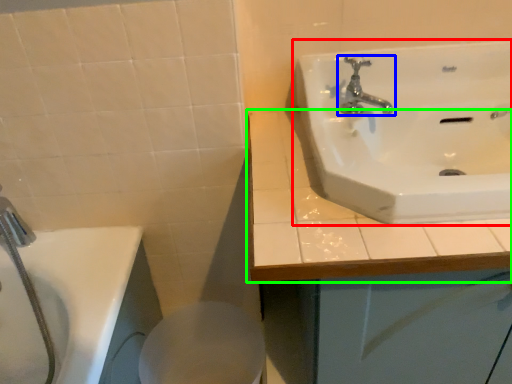
Question: Estimate the real-world distances between objects in this image. Which object is closer to sink (highlighted by a red box), tap (highlighted by a blue box) or counter top (highlighted by a green box)?

Choices:
 (A) tap
 (B) counter top

Answer: (A)